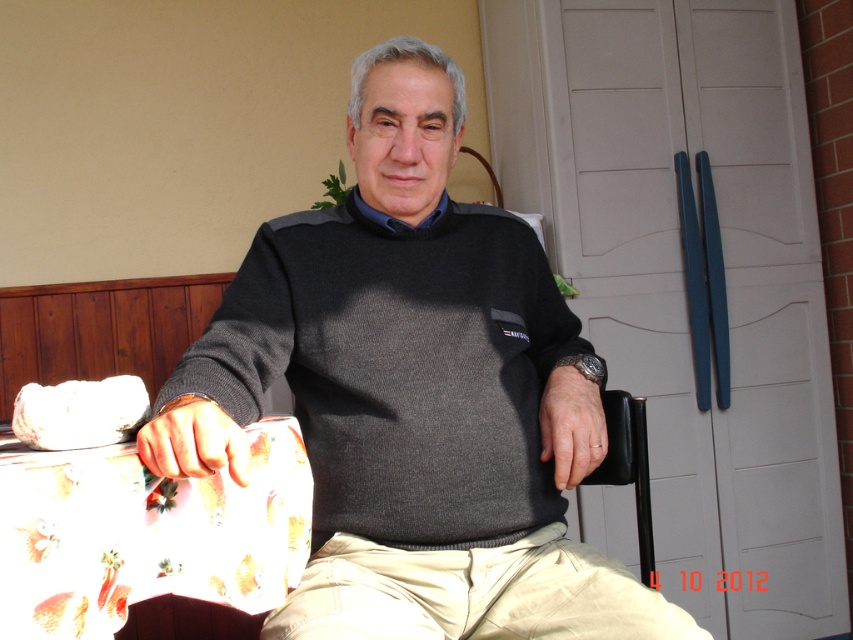
Which is more to the right, dark gray sweater at center or black plastic chair at lower right?

From the viewer's perspective, black plastic chair at lower right appears more on the right side.

Can you confirm if dark gray sweater at center is wider than black plastic chair at lower right?

Indeed, dark gray sweater at center has a greater width compared to black plastic chair at lower right.

Consider the image. Who is more distant from viewer, (637, 611) or (613, 483)?

The point (613, 483) is behind.

This screenshot has height=640, width=853. I want to click on dark gray sweater at center, so click(413, 394).

Based on the photo, can you confirm if dark gray sweater at center is shorter than khaki cotton pants at lower center?

In fact, dark gray sweater at center may be taller than khaki cotton pants at lower center.

This screenshot has height=640, width=853. What are the coordinates of `dark gray sweater at center` in the screenshot? It's located at (413, 394).

This screenshot has height=640, width=853. In order to click on dark gray sweater at center in this screenshot , I will do `click(413, 394)`.

Between point (434, 604) and point (643, 465), which one is positioned in front?

Point (434, 604)

Is point (434, 550) positioned after point (608, 461)?

No.

Locate an element on the screen. The height and width of the screenshot is (640, 853). khaki cotton pants at lower center is located at coordinates (473, 595).